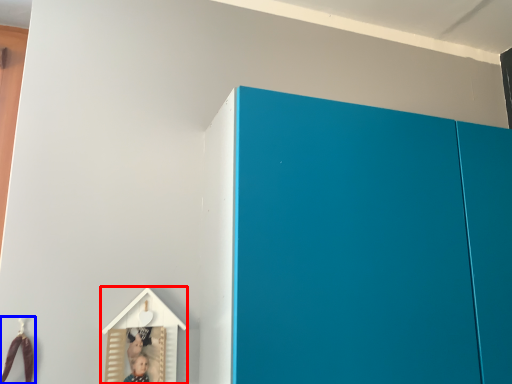
Question: Which object appears farthest to the camera in this image, toy (highlighted by a red box) or toy (highlighted by a blue box)?

Choices:
 (A) toy
 (B) toy

Answer: (A)